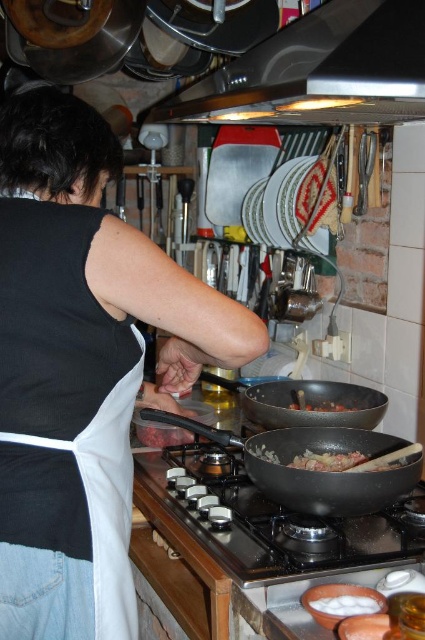
Question: Is shiny black wok at center smaller than white fluffy food at lower center?

Choices:
 (A) no
 (B) yes

Answer: (A)

Question: Does black matte apron at upper left have a lesser width compared to shiny black wok at center?

Choices:
 (A) no
 (B) yes

Answer: (B)

Question: Among these objects, which one is farthest from the camera?

Choices:
 (A) black non-stick wok at center
 (B) black matte apron at upper left
 (C) brown matte food at center
 (D) black matte gas stove at center

Answer: (C)

Question: Can you confirm if black matte apron at upper left is wider than shiny black wok at center?

Choices:
 (A) no
 (B) yes

Answer: (A)

Question: Which of the following is the closest to the observer?

Choices:
 (A) black matte apron at upper left
 (B) brown meaty at center

Answer: (A)

Question: Which object appears farthest from the camera in this image?

Choices:
 (A) white fluffy food at lower center
 (B) shiny black wok at center
 (C) black matte gas stove at center
 (D) black non-stick wok at center

Answer: (B)